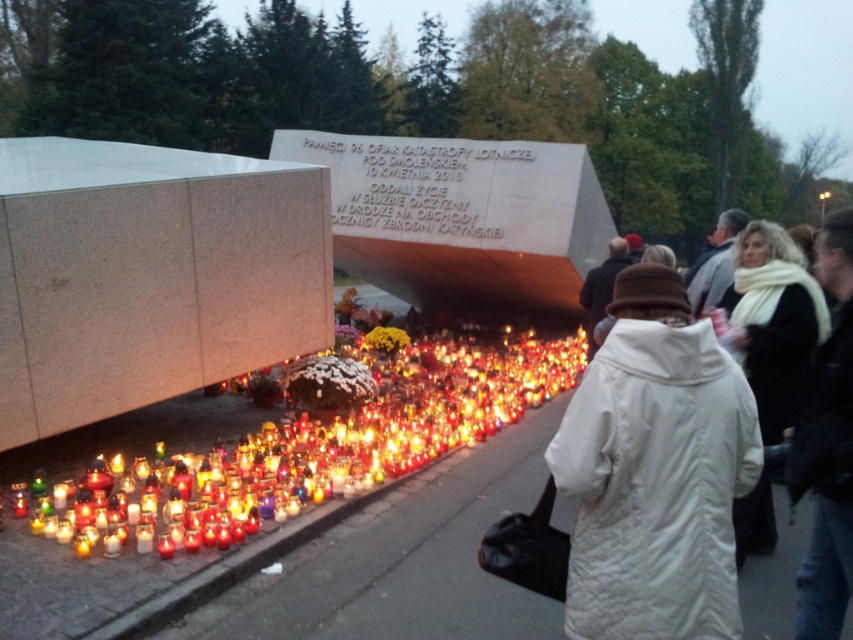
Question: Which object is closer to the camera taking this photo?

Choices:
 (A) white fluffy flowers at lower center
 (B) yellow fabric flowers at lower center
 (C) white wool scarf at upper right

Answer: (C)

Question: Is white wool scarf at upper right wider than white fluffy flowers at lower center?

Choices:
 (A) yes
 (B) no

Answer: (B)

Question: Which point is farther from the camera taking this photo?

Choices:
 (A) tap(280, 384)
 (B) tap(384, 348)

Answer: (B)

Question: Does white wool scarf at upper right appear under white fluffy flowers at lower center?

Choices:
 (A) no
 (B) yes

Answer: (A)

Question: Can you confirm if white wool scarf at upper right is positioned below yellow fabric flowers at lower center?

Choices:
 (A) no
 (B) yes

Answer: (A)

Question: Which point is closer to the camera?

Choices:
 (A) white fluffy flowers at lower center
 (B) white wool scarf at upper right

Answer: (B)